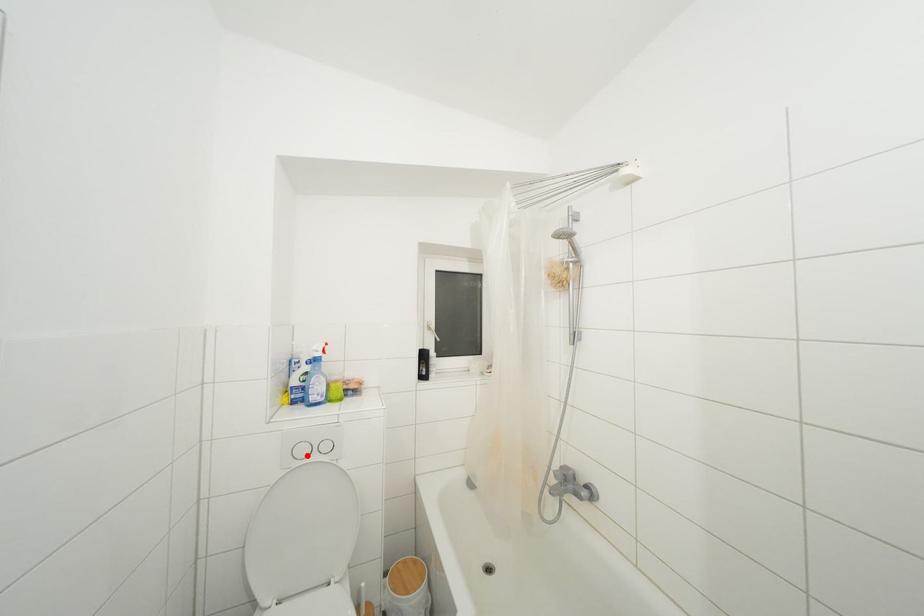
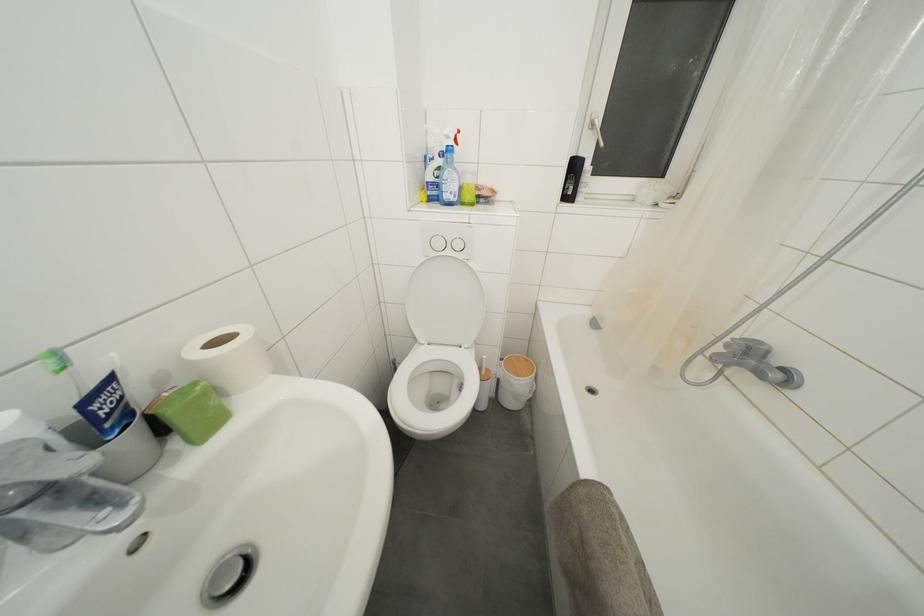
The point at the highlighted location is marked in the first image. Where is the corresponding point in the second image?

(443, 249)